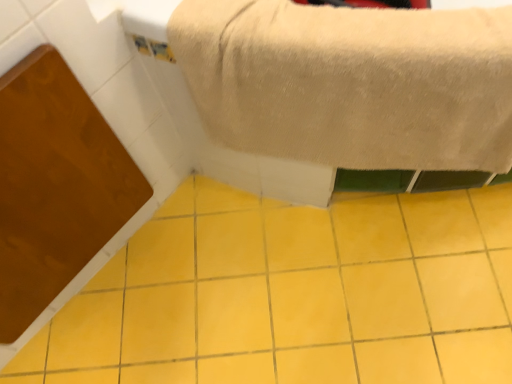
Image resolution: width=512 pixels, height=384 pixels. I want to click on free space above yellow ceramic tile at center (from a real-world perspective), so click(x=300, y=285).